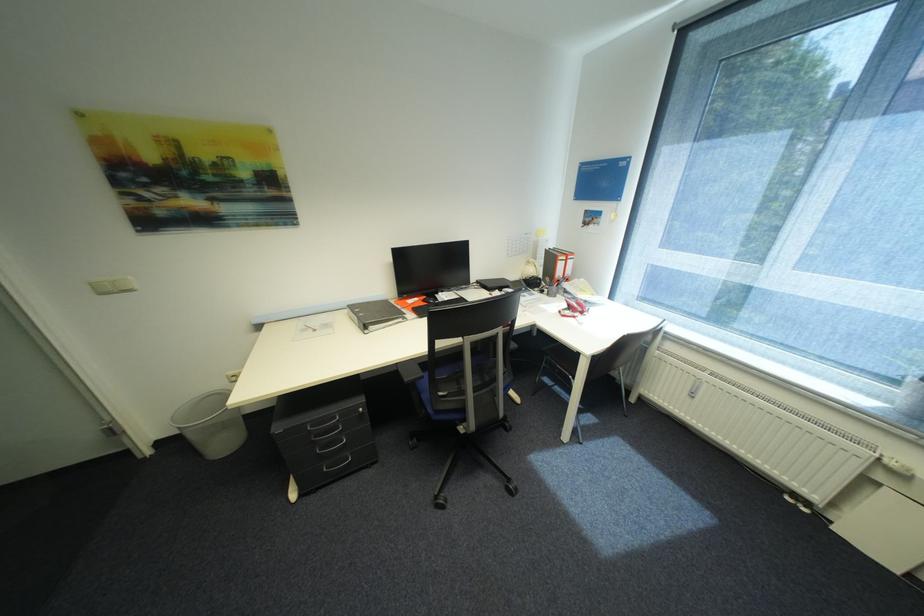
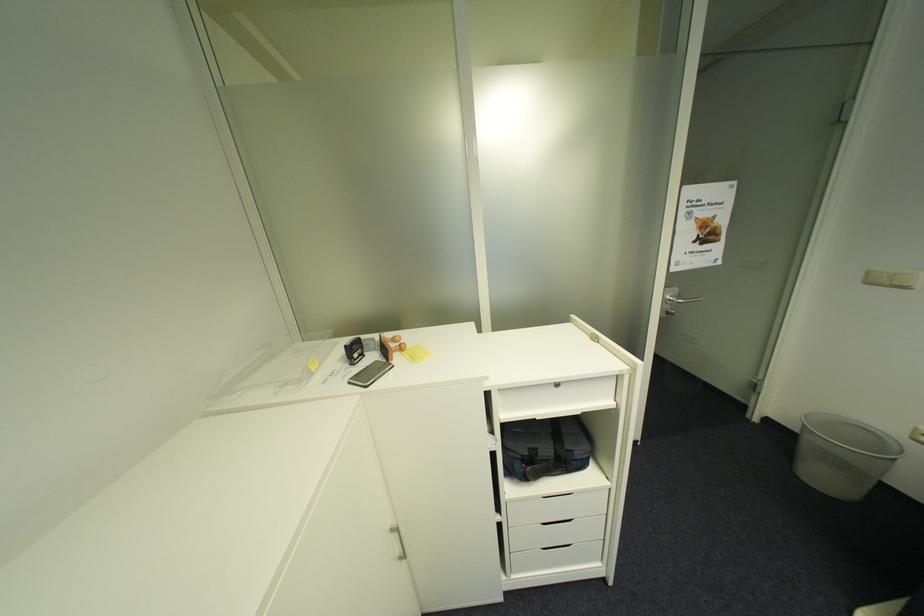
In the second image, find the point that corresponds to (x=110, y=294) in the first image.

(876, 284)